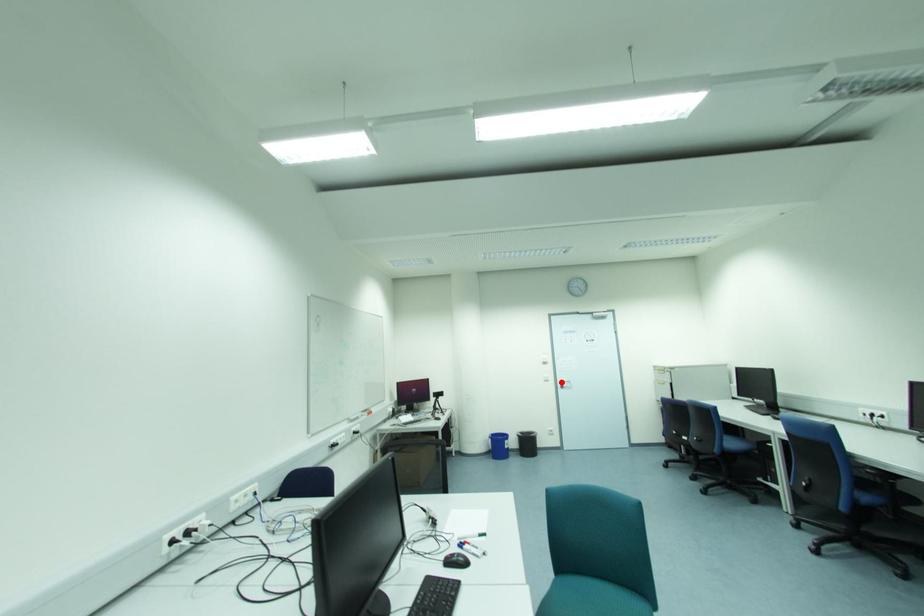
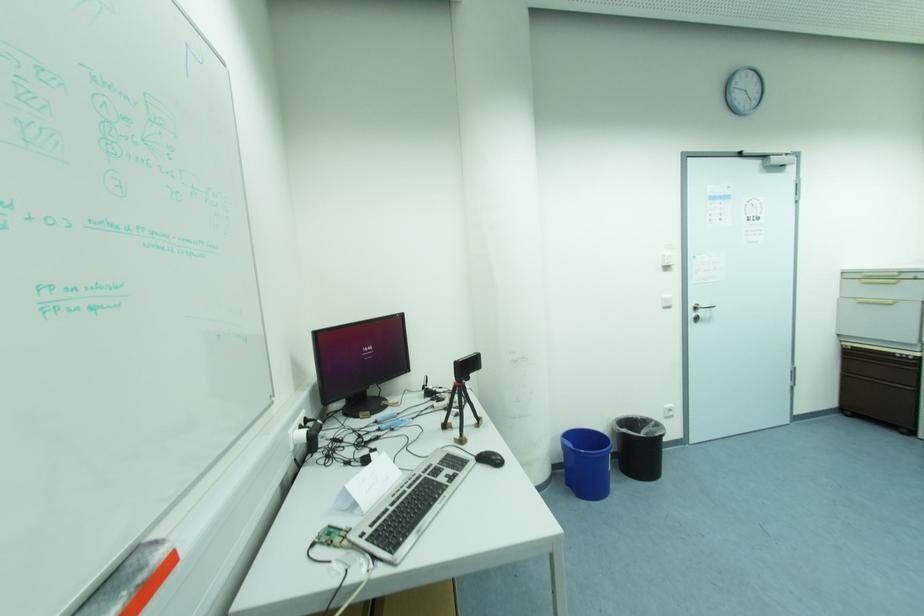
Question: I am providing you with two images of the same scene from different viewpoints. Image1 has a red point marked. In image2, the corresponding 3D location appears at what relative position? Reply with the corresponding letter.

Choices:
 (A) Closer
 (B) Farther

Answer: (A)